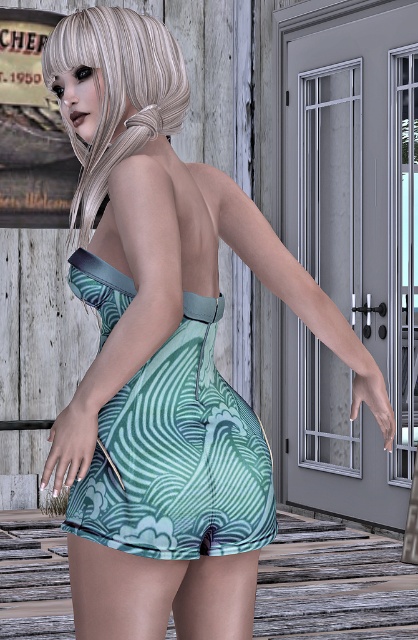
You are a photographer trying to capture the best shot of the scene. You notice two points in the image at coordinates point (183, 384) and point (158, 60). Which point should you focus on to ensure it appears larger in your photo?

Point (183, 384) is closer to the camera than point (158, 60), so focusing on point (183, 384) will make it appear larger in the photo.

A person is standing at point A located at coordinates point (259, 490). If you are 2 meters away from this point, can you see the gray door with glass panels and a metal handle to the right of the old building?

The distance of point (259, 490) from viewer is 2.55 meters. If you are 2 meters away from this point, you are closer to the point than the viewer, so you can see the gray door with glass panels and a metal handle to the right of the old building.

You are a fashion designer observing the image and want to place a new accessory near the green printed fabric dress at center. Based on the dress location at point 0.714, 0.426, where should you position the accessory to maintain visual balance?

The green printed fabric dress at center is located at point (178, 456), so positioning the accessory symmetrically opposite to this coordinate would help maintain visual balance.